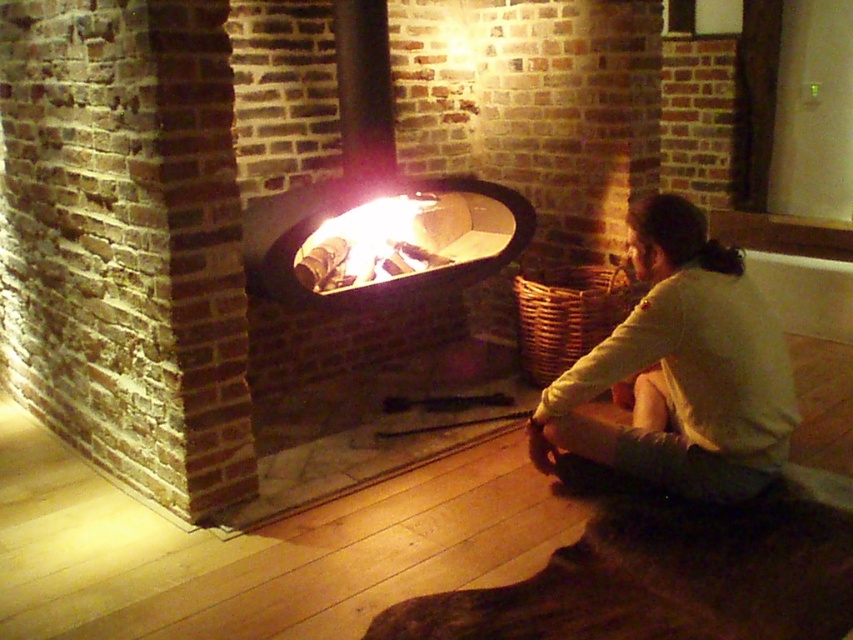
Does light beige cotton shirt at lower right appear on the right side of smooth black fire pit at center?

Correct, you'll find light beige cotton shirt at lower right to the right of smooth black fire pit at center.

Does point (628, 326) come closer to viewer compared to point (397, 282)?

Yes, point (628, 326) is in front of point (397, 282).

The height and width of the screenshot is (640, 853). In order to click on light beige cotton shirt at lower right in this screenshot , I will do `click(680, 371)`.

Is point (486, 218) less distant than point (374, 266)?

No, it is behind (374, 266).

What do you see at coordinates (381, 237) in the screenshot?
I see `smooth black fire pit at center` at bounding box center [381, 237].

This screenshot has height=640, width=853. In order to click on smooth black fire pit at center in this screenshot , I will do `click(381, 237)`.

Between light beige cotton shirt at lower right and charcoal wood fire at center, which one is positioned higher?

Positioned higher is charcoal wood fire at center.

Does point (643, 244) lie in front of point (407, 266)?

Yes, it is.

Find the location of a particular element. This screenshot has height=640, width=853. light beige cotton shirt at lower right is located at coordinates (680, 371).